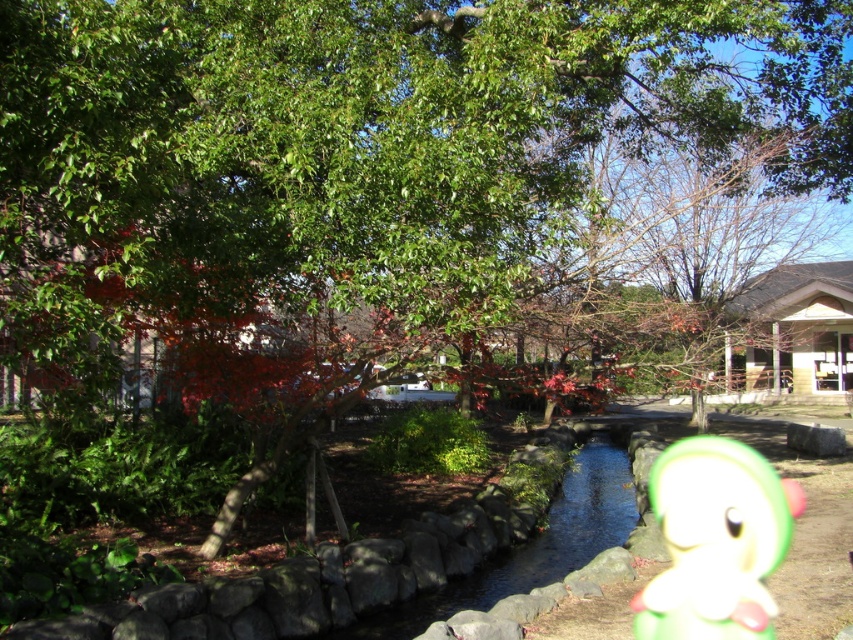
Question: Among these points, which one is nearest to the camera?

Choices:
 (A) (469, 589)
 (B) (740, 520)

Answer: (A)

Question: Can you confirm if green matte plush toy at center is smaller than smooth stone pond at center?

Choices:
 (A) yes
 (B) no

Answer: (A)

Question: Is green matte plush toy at center wider than smooth stone pond at center?

Choices:
 (A) no
 (B) yes

Answer: (A)

Question: Can you confirm if green matte plush toy at center is positioned to the left of smooth stone pond at center?

Choices:
 (A) yes
 (B) no

Answer: (B)

Question: Among these objects, which one is farthest from the camera?

Choices:
 (A) green matte plush toy at center
 (B) smooth stone pond at center

Answer: (B)